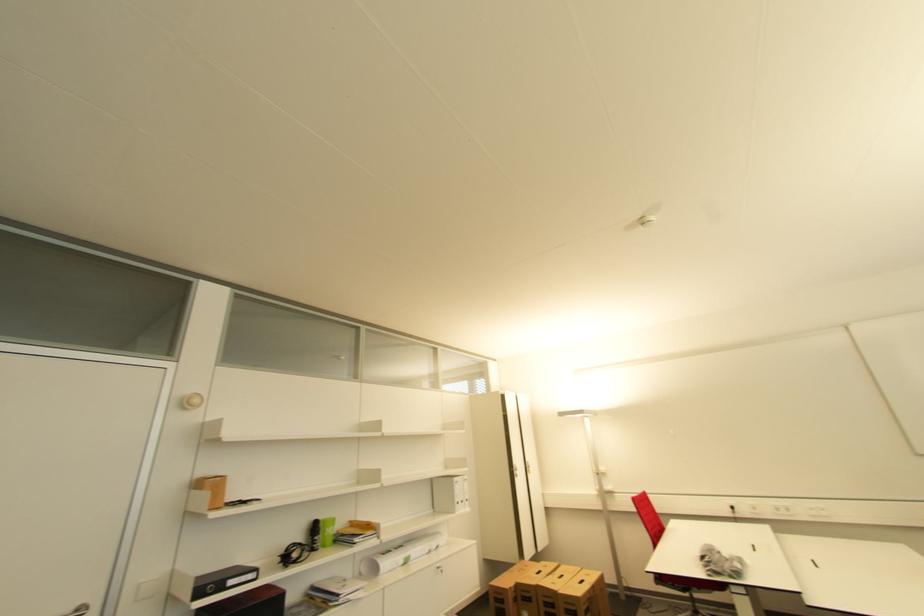
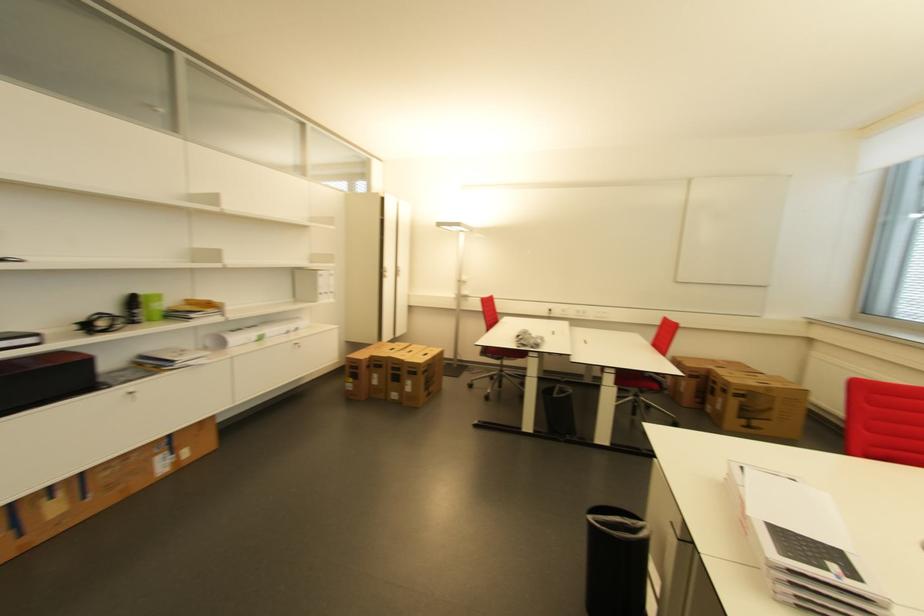
In the second image, find the point that corresponds to pixel 326 527 in the first image.

(147, 301)